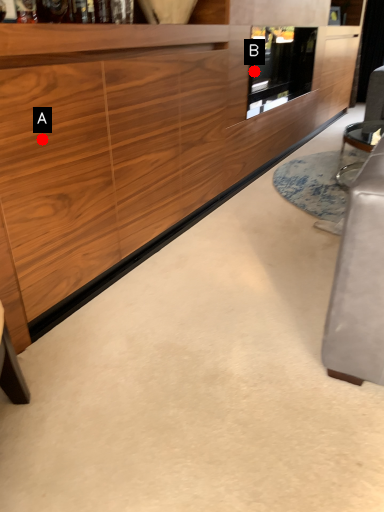
Question: Two points are circled on the image, labeled by A and B beside each circle. Which point appears closest to the camera in this image?

Choices:
 (A) A is closer
 (B) B is closer

Answer: (A)